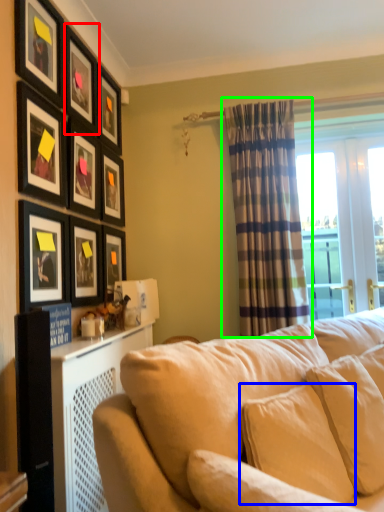
Question: Based on their relative distances, which object is nearer to picture frame (highlighted by a red box)? Choose from pillow (highlighted by a blue box) and curtain (highlighted by a green box).

Choices:
 (A) pillow
 (B) curtain

Answer: (B)